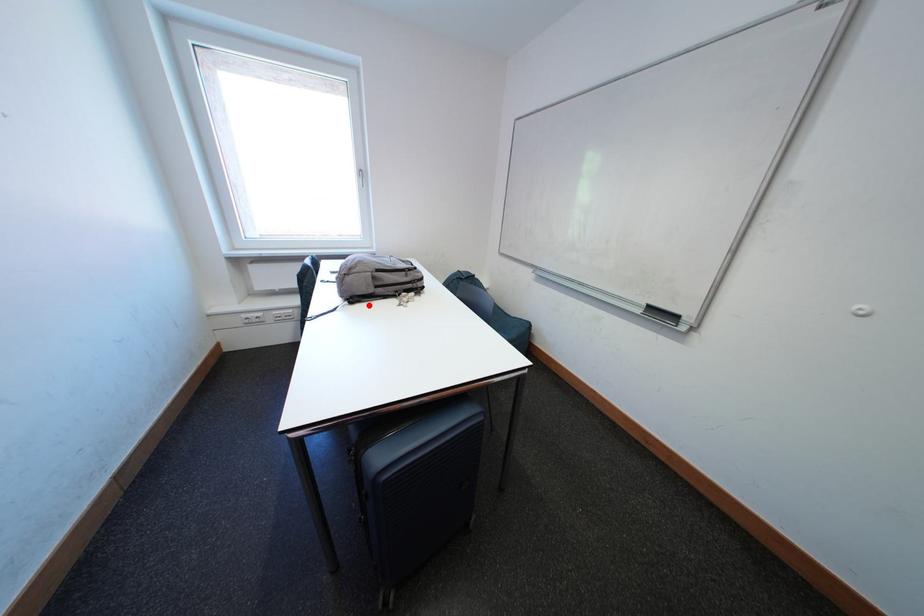
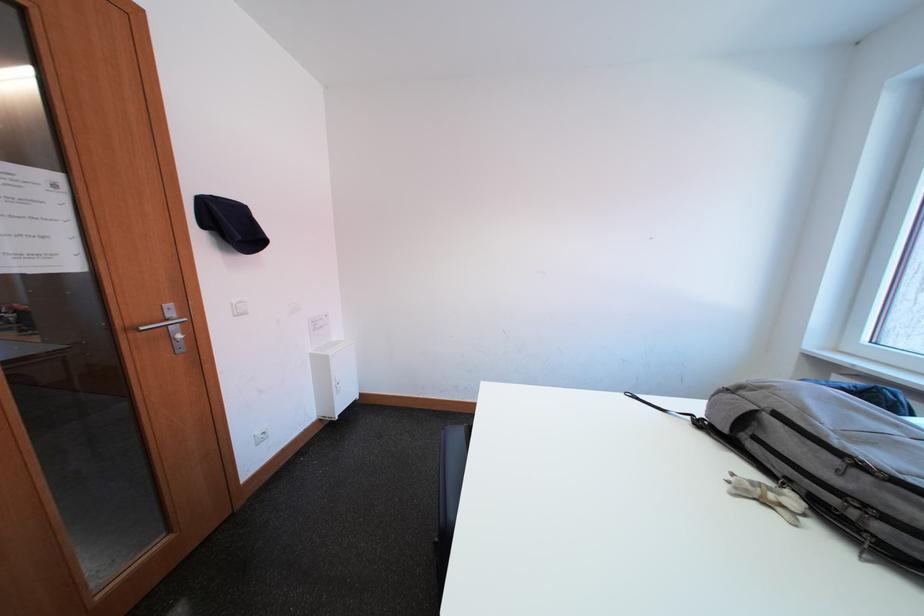
In the second image, find the point that corresponds to the highlighted location in the first image.

(719, 438)